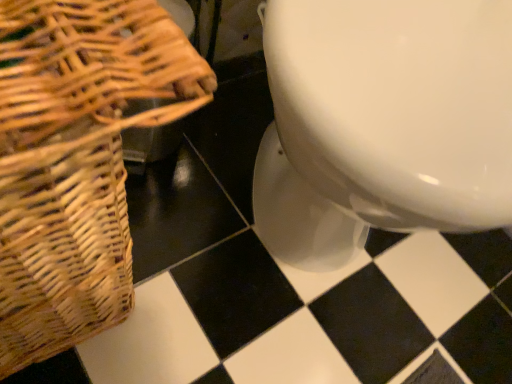
Question: Considering the relative sizes of white glossy toilet at center and woven brown picnic basket at left in the image provided, is white glossy toilet at center shorter than woven brown picnic basket at left?

Choices:
 (A) no
 (B) yes

Answer: (A)

Question: Can you confirm if white glossy toilet at center is taller than woven brown picnic basket at left?

Choices:
 (A) yes
 (B) no

Answer: (A)

Question: From a real-world perspective, is white glossy toilet at center positioned under woven brown picnic basket at left based on gravity?

Choices:
 (A) yes
 (B) no

Answer: (B)

Question: Is white glossy toilet at center at the right side of woven brown picnic basket at left?

Choices:
 (A) yes
 (B) no

Answer: (A)

Question: Considering the relative sizes of white glossy toilet at center and woven brown picnic basket at left in the image provided, is white glossy toilet at center smaller than woven brown picnic basket at left?

Choices:
 (A) no
 (B) yes

Answer: (A)

Question: From a real-world perspective, is white glossy toilet at center positioned over woven brown picnic basket at left based on gravity?

Choices:
 (A) no
 (B) yes

Answer: (B)

Question: Is there a large distance between woven brown picnic basket at left and white glossy toilet at center?

Choices:
 (A) no
 (B) yes

Answer: (A)

Question: Is woven brown picnic basket at left bigger than white glossy toilet at center?

Choices:
 (A) yes
 (B) no

Answer: (B)

Question: From a real-world perspective, is woven brown picnic basket at left positioned over white glossy toilet at center based on gravity?

Choices:
 (A) no
 (B) yes

Answer: (A)

Question: Considering the relative sizes of woven brown picnic basket at left and white glossy toilet at center in the image provided, is woven brown picnic basket at left thinner than white glossy toilet at center?

Choices:
 (A) no
 (B) yes

Answer: (B)

Question: Is woven brown picnic basket at left smaller than white glossy toilet at center?

Choices:
 (A) no
 (B) yes

Answer: (B)

Question: Does woven brown picnic basket at left come in front of white glossy toilet at center?

Choices:
 (A) yes
 (B) no

Answer: (A)

Question: Would you say white glossy toilet at center is inside or outside woven brown picnic basket at left?

Choices:
 (A) outside
 (B) inside

Answer: (A)